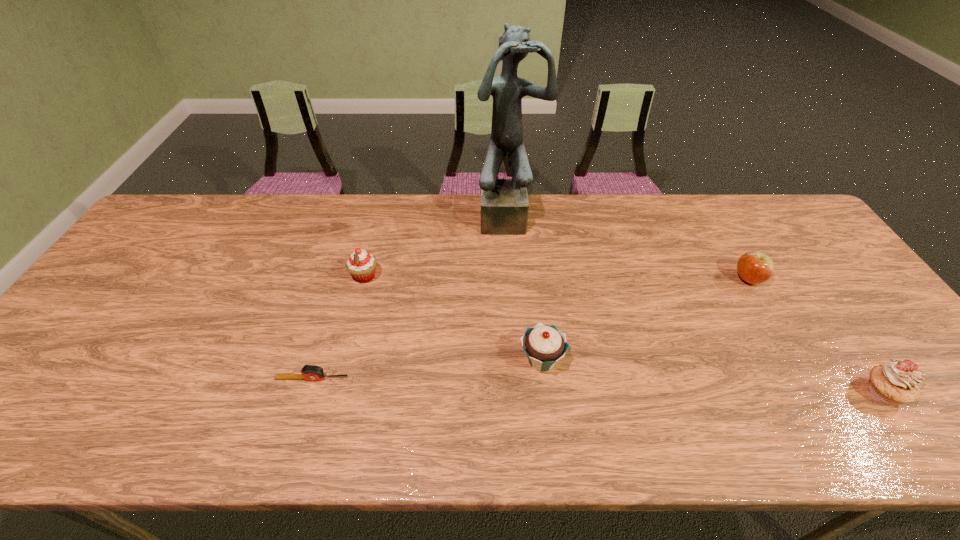
Find the location of a particular element. The width and height of the screenshot is (960, 540). sculpture is located at coordinates (504, 202).

This screenshot has width=960, height=540. I want to click on the farthest object, so click(x=504, y=202).

Identify the location of the farthest cupcake. The height and width of the screenshot is (540, 960). (361, 265).

You are a GUI agent. You are given a task and a screenshot of the screen. Output one action in this format:
    pyautogui.click(x=<x>, y=<y>)
    Task: Click on the second cupcake from left to right
    This screenshot has width=960, height=540.
    Given the screenshot: What is the action you would take?
    coord(544,345)

Find the location of a particular element. The height and width of the screenshot is (540, 960). the rightmost cupcake is located at coordinates (896, 382).

Find the location of a particular element. The image size is (960, 540). the fifth tallest object is located at coordinates (753, 267).

Locate an element on the screen. This screenshot has height=540, width=960. the second object from right to left is located at coordinates (753, 267).

Where is `tape measure`? The height and width of the screenshot is (540, 960). tape measure is located at coordinates [x=309, y=372].

Where is `free location located 0.300m on the face of the tallest object`? Image resolution: width=960 pixels, height=540 pixels. free location located 0.300m on the face of the tallest object is located at coordinates (516, 310).

Identify the location of vacant region located on the back of the leftmost cupcake. The height and width of the screenshot is (540, 960). (x=379, y=217).